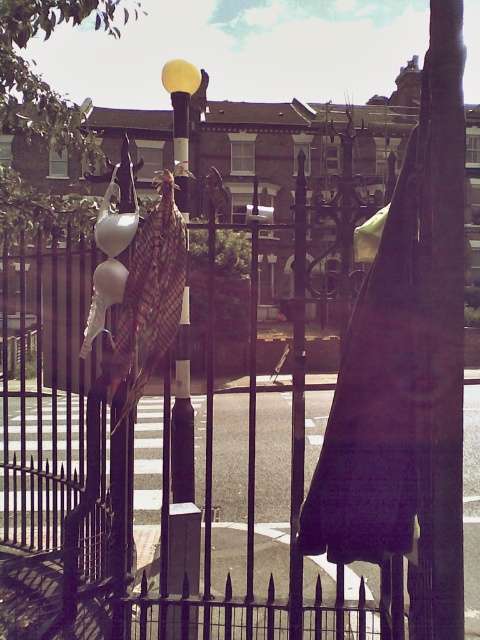
You are a delivery person who needs to place a new 3.5 feet wide package between the matte black umbrella at center and the plaid fabric umbrella at center. Can you fit it there?

The distance between the matte black umbrella at center and the plaid fabric umbrella at center is 3.49 feet, so the 3.5 feet wide package cannot fit between them as it is slightly wider than the available space.

You are standing in front of the metal fence and notice two points marked on the ground. The first point is at coordinate point(115, 220) and the second is at point(113, 304). Which point is closer to you?

Point(115, 220) is closer to you because it is in front of point(113, 304).

You are a delivery person carrying a package that is 2.5 meters long. You need to pass through the space between the matte black umbrella at center and the camera. Will the package fit through this space?

The space between the matte black umbrella at center and the camera is 2.50 meters, so the 2.5 meter long package will fit through this space.